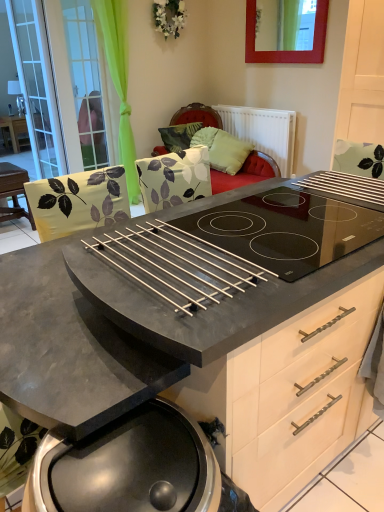
Question: Can you see matte black table at left, the 1th table viewed from the front, touching metallic matte barbecue grill at lower center?

Choices:
 (A) yes
 (B) no

Answer: (B)

Question: Can we say matte black table at left, which is the 1th table in bottom-to-top order, lies outside metallic matte barbecue grill at lower center?

Choices:
 (A) yes
 (B) no

Answer: (A)

Question: Is matte black table at left, the 2th table from the left, further to camera compared to metallic matte barbecue grill at lower center?

Choices:
 (A) yes
 (B) no

Answer: (A)

Question: Is matte black table at left, marked as the 2th table in a back-to-front arrangement, not close to metallic matte barbecue grill at lower center?

Choices:
 (A) no
 (B) yes

Answer: (B)

Question: From the image's perspective, is matte black table at left, the 1th table viewed from the front, beneath metallic matte barbecue grill at lower center?

Choices:
 (A) no
 (B) yes

Answer: (A)

Question: From the image's perspective, is matte black table at left, the 1th table viewed from the front, over metallic matte barbecue grill at lower center?

Choices:
 (A) no
 (B) yes

Answer: (B)

Question: From a real-world perspective, is red wood picture frame at upper center positioned under matte black table at left, acting as the first table starting from the top, based on gravity?

Choices:
 (A) no
 (B) yes

Answer: (A)

Question: Could matte black table at left, acting as the first table starting from the top, be considered to be inside red wood picture frame at upper center?

Choices:
 (A) yes
 (B) no

Answer: (B)

Question: Is red wood picture frame at upper center taller than matte black table at left, acting as the second table starting from the front?

Choices:
 (A) no
 (B) yes

Answer: (A)

Question: Does red wood picture frame at upper center have a lesser height compared to matte black table at left, the first table when ordered from left to right?

Choices:
 (A) no
 (B) yes

Answer: (B)

Question: Is red wood picture frame at upper center turned away from matte black table at left, the first table when ordered from left to right?

Choices:
 (A) yes
 (B) no

Answer: (B)

Question: Is red wood picture frame at upper center at the right side of matte black table at left, acting as the second table starting from the front?

Choices:
 (A) no
 (B) yes

Answer: (B)

Question: Is green leaf-patterned pillow at upper center, the second pillow in the right-to-left sequence, not close to green fabric screen door at upper left, the second screen door in the left-to-right sequence?

Choices:
 (A) no
 (B) yes

Answer: (A)